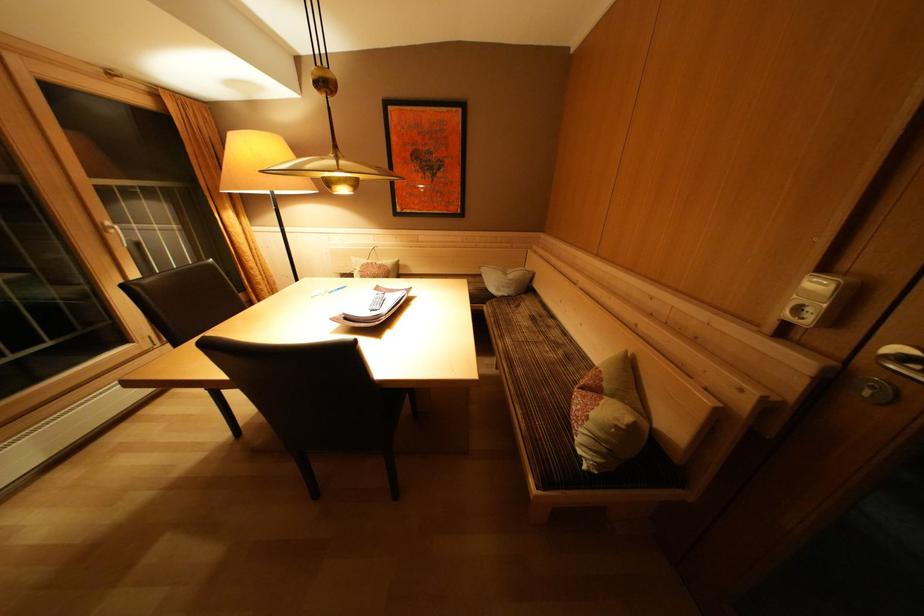
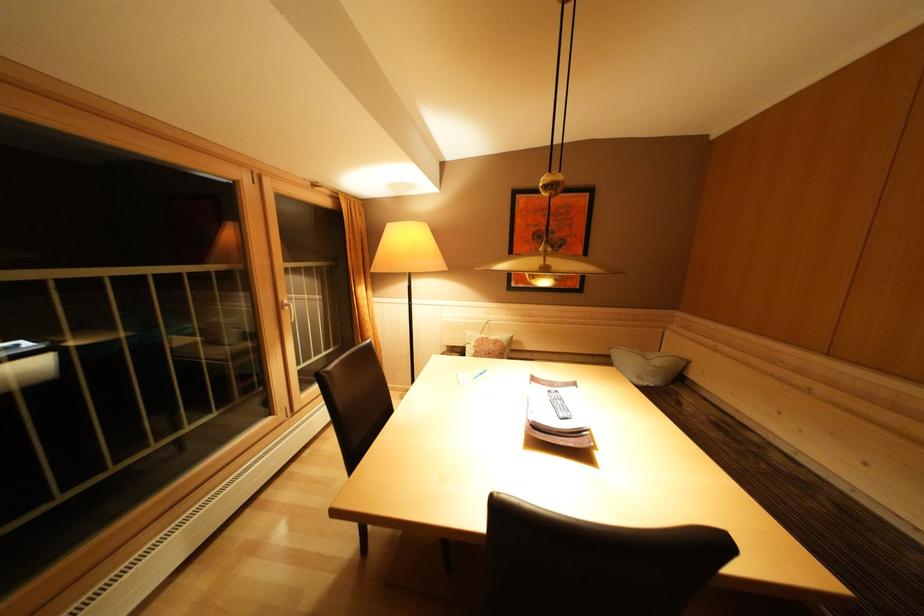
Question: In a continuous first-person perspective shot, in which direction is the camera moving?

Choices:
 (A) Left
 (B) Right
 (C) Forward
 (D) Backward

Answer: (A)